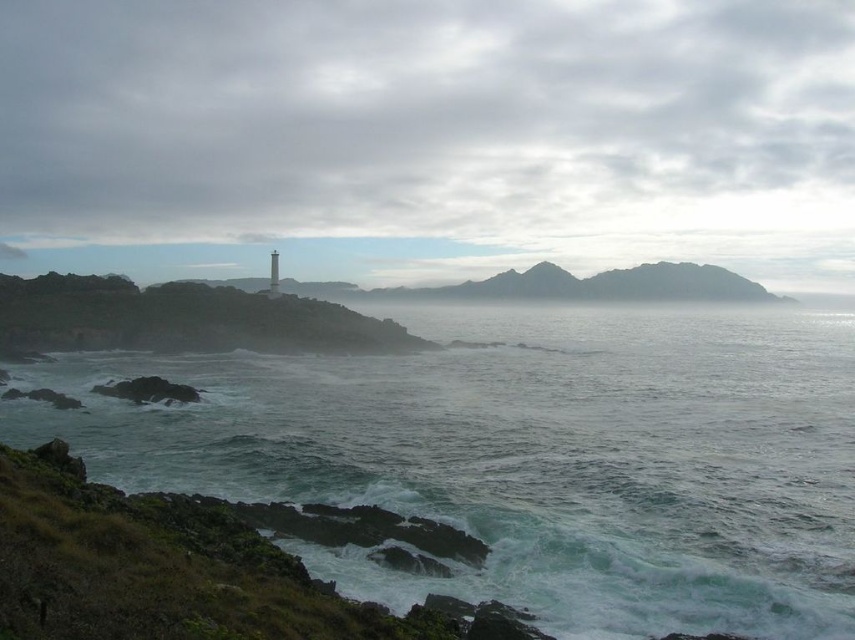
Is point (65, 333) farther from camera compared to point (276, 285)?

No, (65, 333) is in front of (276, 285).

Can you confirm if rugged stone cliff at center-left is bigger than white concrete pillar at upper center?

Yes.

Between point (10, 348) and point (276, 292), which one is positioned behind?

Positioned behind is point (276, 292).

At what (x,y) coordinates should I click in order to perform the action: click on rugged stone cliff at center-left. Please return your answer as a coordinate pair (x, y). This screenshot has height=640, width=855. Looking at the image, I should click on (180, 320).

From the picture: Between white frothy water at lower left and white concrete pillar at upper center, which one is positioned higher?

white concrete pillar at upper center is above.

Can you confirm if white frothy water at lower left is bigger than white concrete pillar at upper center?

Yes, white frothy water at lower left is bigger than white concrete pillar at upper center.

Is point (549, 516) positioned in front of point (272, 280)?

Yes, it is.

Locate an element on the screen. This screenshot has height=640, width=855. white frothy water at lower left is located at coordinates (529, 456).

From the picture: Which is more to the left, white frothy water at lower left or rugged stone cliff at center-left?

rugged stone cliff at center-left is more to the left.

Is point (171, 444) closer to viewer compared to point (65, 324)?

Yes, it is.

The height and width of the screenshot is (640, 855). What do you see at coordinates (529, 456) in the screenshot?
I see `white frothy water at lower left` at bounding box center [529, 456].

Where is `white frothy water at lower left`? The width and height of the screenshot is (855, 640). white frothy water at lower left is located at coordinates (529, 456).